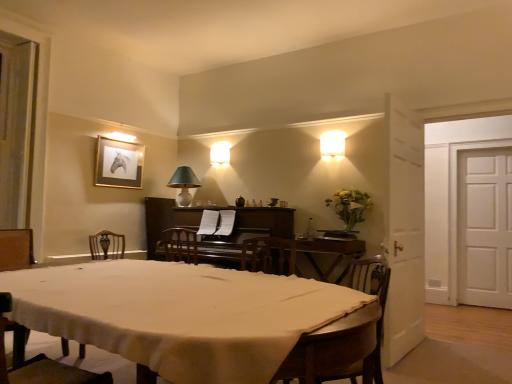
Question: Can you confirm if matte green lampshade at upper center, the second lamp from the right, is thinner than wooden striped chair at lower right, the first chair in the right-to-left sequence?

Choices:
 (A) yes
 (B) no

Answer: (A)

Question: From the image's perspective, is matte green lampshade at upper center, the second lamp from the right, located above wooden striped chair at lower right, the first chair in the right-to-left sequence?

Choices:
 (A) yes
 (B) no

Answer: (A)

Question: Is wooden striped chair at lower right, the 1th chair from the back, completely or partially inside matte green lampshade at upper center, arranged as the second lamp when viewed from the left?

Choices:
 (A) yes
 (B) no

Answer: (B)

Question: Is matte green lampshade at upper center, arranged as the second lamp when viewed from the left, looking in the opposite direction of wooden striped chair at lower right, the first chair in the right-to-left sequence?

Choices:
 (A) yes
 (B) no

Answer: (B)

Question: Is matte green lampshade at upper center, which is the 1th lamp in back-to-front order, at the right side of wooden striped chair at lower right, the first chair in the right-to-left sequence?

Choices:
 (A) no
 (B) yes

Answer: (A)

Question: Considering the positions of point (309, 235) and point (335, 155), is point (309, 235) closer or farther from the camera than point (335, 155)?

Choices:
 (A) farther
 (B) closer

Answer: (A)

Question: Based on their sizes in the image, would you say clear glass bottle at center is bigger or smaller than matte white lampshade at upper right, which is the first lamp from front to back?

Choices:
 (A) big
 (B) small

Answer: (B)

Question: Relative to matte white lampshade at upper right, which appears as the 3th lamp when viewed from the left, is clear glass bottle at center in front or behind?

Choices:
 (A) behind
 (B) front

Answer: (A)

Question: From the image's perspective, is clear glass bottle at center located above or below matte white lampshade at upper right, arranged as the 1th lamp when viewed from the right?

Choices:
 (A) below
 (B) above

Answer: (A)

Question: Relative to dark brown polished wood piano at center, is white cloth-covered table at center in front or behind?

Choices:
 (A) behind
 (B) front

Answer: (B)

Question: Is point (362, 292) closer or farther from the camera than point (187, 226)?

Choices:
 (A) farther
 (B) closer

Answer: (B)

Question: From a real-world perspective, is white cloth-covered table at center physically located above or below dark brown polished wood piano at center?

Choices:
 (A) below
 (B) above

Answer: (A)

Question: Considering the relative positions of white cloth-covered table at center and dark brown polished wood piano at center in the image provided, is white cloth-covered table at center to the left or to the right of dark brown polished wood piano at center?

Choices:
 (A) left
 (B) right

Answer: (A)

Question: Would you say white cloth-covered table at center is to the left or to the right of matte white lampshade at upper right, which appears as the 3th lamp when viewed from the left, in the picture?

Choices:
 (A) right
 (B) left

Answer: (B)

Question: From a real-world perspective, is white cloth-covered table at center positioned above or below matte white lampshade at upper right, the third lamp from the back?

Choices:
 (A) below
 (B) above

Answer: (A)